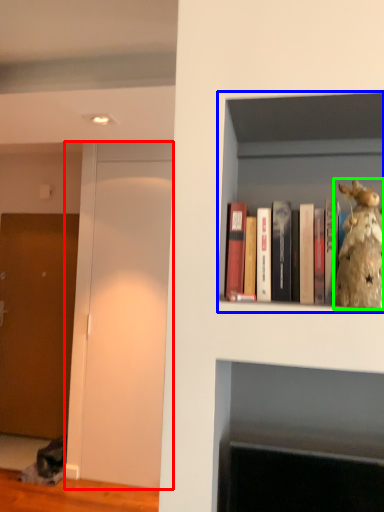
Question: Which object is positioned closest to glass door (highlighted by a red box)? Select from shelf (highlighted by a blue box) and figurine (highlighted by a green box).

Choices:
 (A) shelf
 (B) figurine

Answer: (A)